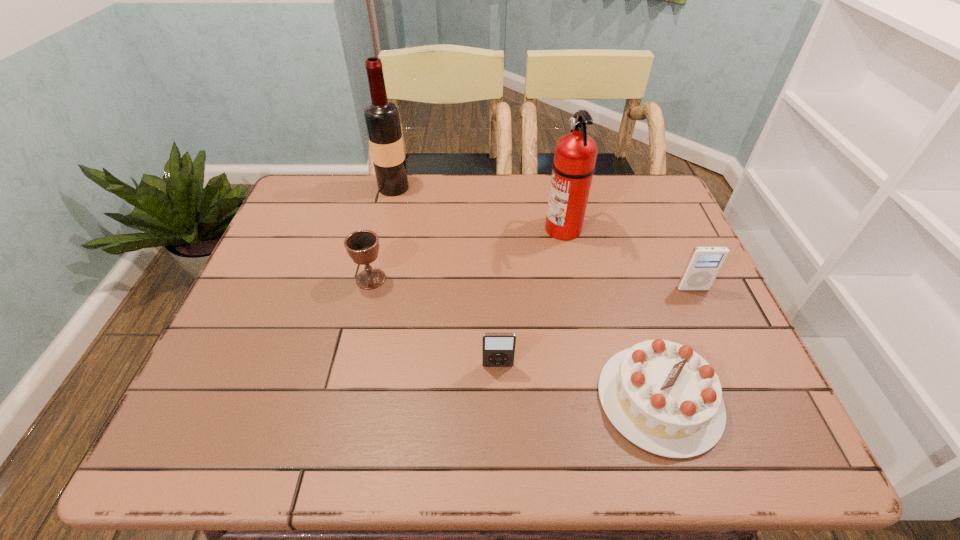
Locate an element on the screen. This screenshot has height=540, width=960. the farthest object is located at coordinates (382, 118).

This screenshot has height=540, width=960. What are the coordinates of `the fifth nearest object` in the screenshot? It's located at (575, 155).

Find the location of a particular element. The image size is (960, 540). the taller iPod is located at coordinates (704, 264).

Locate an element on the screen. This screenshot has width=960, height=540. the right iPod is located at coordinates (704, 264).

Locate an element on the screen. chalice is located at coordinates (362, 246).

Where is `the left iPod`? This screenshot has width=960, height=540. the left iPod is located at coordinates (498, 348).

Identify the location of the shorter iPod. (498, 348).

The image size is (960, 540). I want to click on birthday cake, so click(665, 398).

Where is `vacant space situated 0.090m on the left of the wine bottle`? The width and height of the screenshot is (960, 540). vacant space situated 0.090m on the left of the wine bottle is located at coordinates (350, 188).

Locate an element on the screen. free space located at the nozzle of the fire extinguisher is located at coordinates (495, 228).